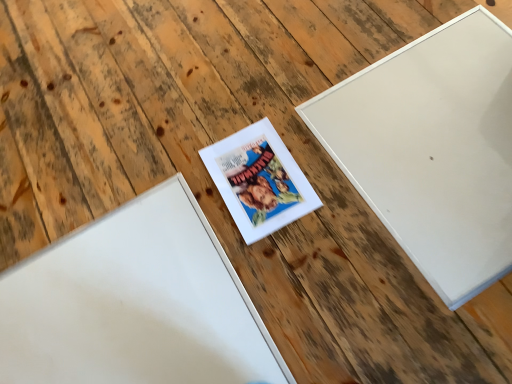
Find the location of `vacant area on top of white matte picture frame at center, positioned as the 2th picture frame in right-to-left order (from a real-world perspective)`. vacant area on top of white matte picture frame at center, positioned as the 2th picture frame in right-to-left order (from a real-world perspective) is located at coordinates (259, 179).